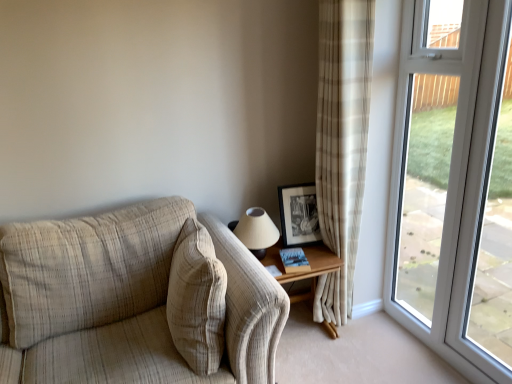
The height and width of the screenshot is (384, 512). Find the location of `empty space that is to the right of beige plaid curtain at right`. empty space that is to the right of beige plaid curtain at right is located at coordinates (381, 324).